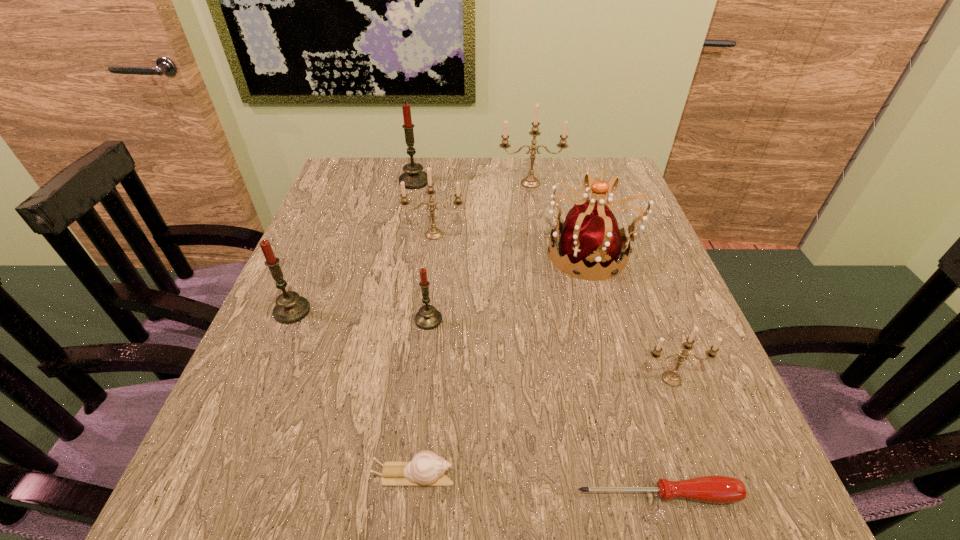
Identify which object is the second closest to the rightmost red candle. Please provide its 2D coordinates. Your answer should be formatted as a tuple, i.e. [(x, y)], where the tuple contains the x and y coordinates of a point satisfying the conditions above.

[(433, 233)]

What are the coordinates of `the fifth closest object to the leftmost red candle` in the screenshot? It's located at (590, 238).

Identify which candle is located as the third nearest to the leftmost candle. Please provide its 2D coordinates. Your answer should be formatted as a tuple, i.e. [(x, y)], where the tuple contains the x and y coordinates of a point satisfying the conditions above.

[(414, 178)]

Identify which candle is the fifth closest to the biggest red candle. Please provide its 2D coordinates. Your answer should be formatted as a tuple, i.e. [(x, y)], where the tuple contains the x and y coordinates of a point satisfying the conditions above.

[(672, 378)]

Select which red candle is the third closest to the escargot. Please provide its 2D coordinates. Your answer should be formatted as a tuple, i.e. [(x, y)], where the tuple contains the x and y coordinates of a point satisfying the conditions above.

[(414, 178)]

At what (x,y) coordinates should I click in order to perform the action: click on red candle that can be found as the closest to the rightmost red candle. Please return your answer as a coordinate pair (x, y). The width and height of the screenshot is (960, 540). Looking at the image, I should click on (290, 308).

Identify the location of metallic candle that is the second nearest to the shortest object. The width and height of the screenshot is (960, 540). click(433, 233).

I want to click on metallic candle that is the nearest to the red screwdriver, so click(672, 378).

The image size is (960, 540). In order to click on vacant area that satisfies the following two spatial constraints: 1. on the front side of the nearest candle; 2. on the right side of the smallest red candle in this screenshot , I will do `click(421, 379)`.

Locate an element on the screen. The height and width of the screenshot is (540, 960). vacant space that satisfies the following two spatial constraints: 1. on the front side of the red screwdriver; 2. on the right side of the farthest red candle is located at coordinates (349, 495).